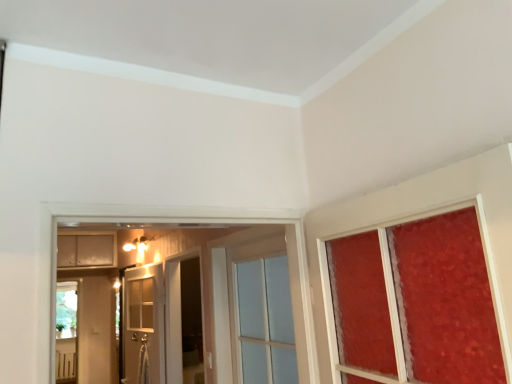
Locate an element on the screen. The image size is (512, 384). white glass door at center, the 2th door when ordered from right to left is located at coordinates (143, 325).

This screenshot has width=512, height=384. Identify the location of transparent glass screen door at center. (183, 318).

Which of these two, transparent glass screen door at center or white glass door at center, the 1th door in the left-to-right sequence, is thinner?

Thinner between the two is white glass door at center, the 1th door in the left-to-right sequence.

Locate an element on the screen. screen door that appears above the white glass door at center, the 2th door when ordered from right to left (from the image's perspective) is located at coordinates 183,318.

Does transparent glass screen door at center have a greater height compared to white glass door at center, the 2th door when ordered from right to left?

No.

Is point (196, 358) in front of point (132, 370)?

No, (196, 358) is further to viewer.

Could you tell me if white glass door at center, placed as the second door when sorted from front to back, is facing matte white cabinet at upper left?

No, white glass door at center, placed as the second door when sorted from front to back, is not aimed at matte white cabinet at upper left.

In terms of width, does white glass door at center, which is the first door in back-to-front order, look wider or thinner when compared to matte white cabinet at upper left?

In the image, white glass door at center, which is the first door in back-to-front order, appears to be more narrow than matte white cabinet at upper left.

Would you say white glass door at center, the 1th door in the left-to-right sequence, contains matte white cabinet at upper left?

No, matte white cabinet at upper left is not surrounded by white glass door at center, the 1th door in the left-to-right sequence.

Can you tell me how much white glass door at center, the 2th door when ordered from right to left, and matte white cabinet at upper left differ in facing direction?

There is a 80.7-degree angle between the facing directions of white glass door at center, the 2th door when ordered from right to left, and matte white cabinet at upper left.

Is white glass door at center, placed as the second door when sorted from front to back, not close to clear glass door at center, placed as the second door when sorted from back to front?

Indeed, white glass door at center, placed as the second door when sorted from front to back, is not near clear glass door at center, placed as the second door when sorted from back to front.

Is white glass door at center, the 1th door in the left-to-right sequence, spatially inside clear glass door at center, placed as the second door when sorted from back to front, or outside of it?

white glass door at center, the 1th door in the left-to-right sequence, is located beyond the bounds of clear glass door at center, placed as the second door when sorted from back to front.

From a real-world perspective, is white glass door at center, the 1th door in the left-to-right sequence, on clear glass door at center, the second door positioned from the left?

No, from a real-world perspective, white glass door at center, the 1th door in the left-to-right sequence, is not over clear glass door at center, the second door positioned from the left

Which object is closer to the camera taking this photo, white glass door at center, the 1th door in the left-to-right sequence, or clear glass door at center, marked as the 1th door in a right-to-left arrangement?

clear glass door at center, marked as the 1th door in a right-to-left arrangement, is in front.

Is transparent glass screen door at center inside or outside of clear glass door at center, placed as the second door when sorted from back to front?

Answer: transparent glass screen door at center is located beyond the bounds of clear glass door at center, placed as the second door when sorted from back to front.

From the image's perspective, is transparent glass screen door at center located above clear glass door at center, which is the 1th door from front to back?

No, from the image's perspective, transparent glass screen door at center is not on top of clear glass door at center, which is the 1th door from front to back.

Which is in front, transparent glass screen door at center or clear glass door at center, which is the 1th door from front to back?

clear glass door at center, which is the 1th door from front to back, is closer to the camera.

Would you consider transparent glass screen door at center to be distant from clear glass door at center, the second door positioned from the left?

Yes, transparent glass screen door at center and clear glass door at center, the second door positioned from the left, are quite far apart.

Which is correct: clear glass door at center, the second door positioned from the left, is inside white glass door at center, which is the first door in back-to-front order, or outside of it?

clear glass door at center, the second door positioned from the left, exists outside the volume of white glass door at center, which is the first door in back-to-front order.

Is the surface of clear glass door at center, which is the 1th door from front to back, in direct contact with white glass door at center, placed as the second door when sorted from front to back?

No, clear glass door at center, which is the 1th door from front to back, is not in contact with white glass door at center, placed as the second door when sorted from front to back.

Can you confirm if clear glass door at center, placed as the second door when sorted from back to front, is wider than white glass door at center, the 1th door in the left-to-right sequence?

Yes.

The height and width of the screenshot is (384, 512). What are the coordinates of `door on the left of clear glass door at center, the second door positioned from the left` in the screenshot? It's located at (143, 325).

How far apart are transparent glass screen door at center and matte white cabinet at upper left?

transparent glass screen door at center is 5.12 feet away from matte white cabinet at upper left.

Is transparent glass screen door at center turned away from matte white cabinet at upper left?

transparent glass screen door at center is not turned away from matte white cabinet at upper left.

Is transparent glass screen door at center shorter than matte white cabinet at upper left?

In fact, transparent glass screen door at center may be taller than matte white cabinet at upper left.

Considering the sizes of objects transparent glass screen door at center and matte white cabinet at upper left in the image provided, who is smaller, transparent glass screen door at center or matte white cabinet at upper left?

Smaller between the two is transparent glass screen door at center.

Identify the location of screen door on the left of clear glass door at center, placed as the second door when sorted from back to front. 183,318.

From the image's perspective, between clear glass door at center, placed as the second door when sorted from back to front, and transparent glass screen door at center, which one is located above?

clear glass door at center, placed as the second door when sorted from back to front, from the image's perspective.

Does clear glass door at center, which is the 1th door from front to back, have a greater width compared to transparent glass screen door at center?

In fact, clear glass door at center, which is the 1th door from front to back, might be narrower than transparent glass screen door at center.

What are the coordinates of `door on the left of the transparent glass screen door at center` in the screenshot? It's located at (143, 325).

There is a matte white cabinet at upper left. At what (x,y) coordinates should I click in order to perform the action: click on the 2nd door below it (from a real-world perspective). Please return your answer as a coordinate pair (x, y). Image resolution: width=512 pixels, height=384 pixels. Looking at the image, I should click on (143, 325).

From the image, which object appears to be farther from matte white cabinet at upper left, clear glass door at center, the second door positioned from the left, or transparent glass screen door at center?

clear glass door at center, the second door positioned from the left.

Estimate the real-world distances between objects in this image. Which object is further from transparent glass screen door at center, clear glass door at center, which is the 1th door from front to back, or white glass door at center, placed as the second door when sorted from front to back?

clear glass door at center, which is the 1th door from front to back, is further to transparent glass screen door at center.

When comparing their distances from transparent glass screen door at center, does matte white cabinet at upper left or white glass door at center, which is the first door in back-to-front order, seem closer?

Based on the image, white glass door at center, which is the first door in back-to-front order, appears to be nearer to transparent glass screen door at center.

Which object lies nearer to the anchor point white glass door at center, placed as the second door when sorted from front to back, transparent glass screen door at center or clear glass door at center, which is the 1th door from front to back?

transparent glass screen door at center lies closer to white glass door at center, placed as the second door when sorted from front to back, than the other object.

Looking at the image, which one is located closer to clear glass door at center, placed as the second door when sorted from back to front, transparent glass screen door at center or matte white cabinet at upper left?

transparent glass screen door at center lies closer to clear glass door at center, placed as the second door when sorted from back to front, than the other object.

In the scene shown: From the image, which object appears to be farther from clear glass door at center, the second door positioned from the left, transparent glass screen door at center or white glass door at center, the 1th door in the left-to-right sequence?

The object further to clear glass door at center, the second door positioned from the left, is white glass door at center, the 1th door in the left-to-right sequence.

Which object lies further to the anchor point clear glass door at center, the second door positioned from the left, matte white cabinet at upper left or transparent glass screen door at center?

Among the two, matte white cabinet at upper left is located further to clear glass door at center, the second door positioned from the left.

Based on their spatial positions, is white glass door at center, placed as the second door when sorted from front to back, or clear glass door at center, marked as the 1th door in a right-to-left arrangement, further from matte white cabinet at upper left?

clear glass door at center, marked as the 1th door in a right-to-left arrangement, is further to matte white cabinet at upper left.

Where is `door between transparent glass screen door at center and matte white cabinet at upper left in the front-back direction`? door between transparent glass screen door at center and matte white cabinet at upper left in the front-back direction is located at coordinates (143, 325).

Locate an element on the screen. This screenshot has height=384, width=512. door between clear glass door at center, placed as the second door when sorted from back to front, and matte white cabinet at upper left from front to back is located at coordinates (143, 325).

Find the location of a particular element. The height and width of the screenshot is (384, 512). screen door between clear glass door at center, marked as the 1th door in a right-to-left arrangement, and matte white cabinet at upper left from front to back is located at coordinates (183, 318).

This screenshot has height=384, width=512. I want to click on screen door positioned between clear glass door at center, which is the 1th door from front to back, and white glass door at center, the 1th door in the left-to-right sequence, from near to far, so click(x=183, y=318).